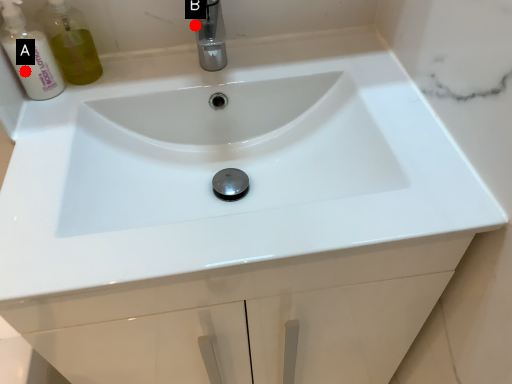
Question: Two points are circled on the image, labeled by A and B beside each circle. Which point appears closest to the camera in this image?

Choices:
 (A) A is closer
 (B) B is closer

Answer: (A)